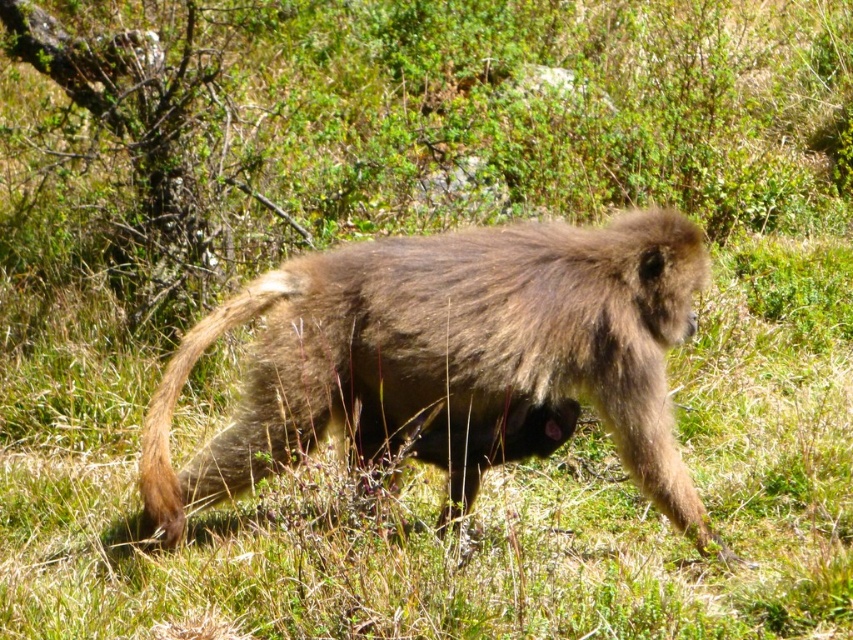
Looking at this image, you are a wildlife photographer trying to capture a clear photo of the brown furry monkey at center and the brown fuzzy tail at lower left. Which one will appear larger in your photo?

The brown furry monkey at center will appear larger in the photo because it is closer to the viewer than the brown fuzzy tail at lower left.

You are a wildlife photographer trying to capture a photo of the brown furry monkey at center and the brown fuzzy tail at lower left. Your camera has a maximum focus range of 20 inches. Can you focus on both subjects simultaneously?

The brown furry monkey at center is 22.97 inches away from the brown fuzzy tail at lower left. Since the distance between them exceeds the camera maximum focus range of 20 inches, you cannot focus on both subjects simultaneously.